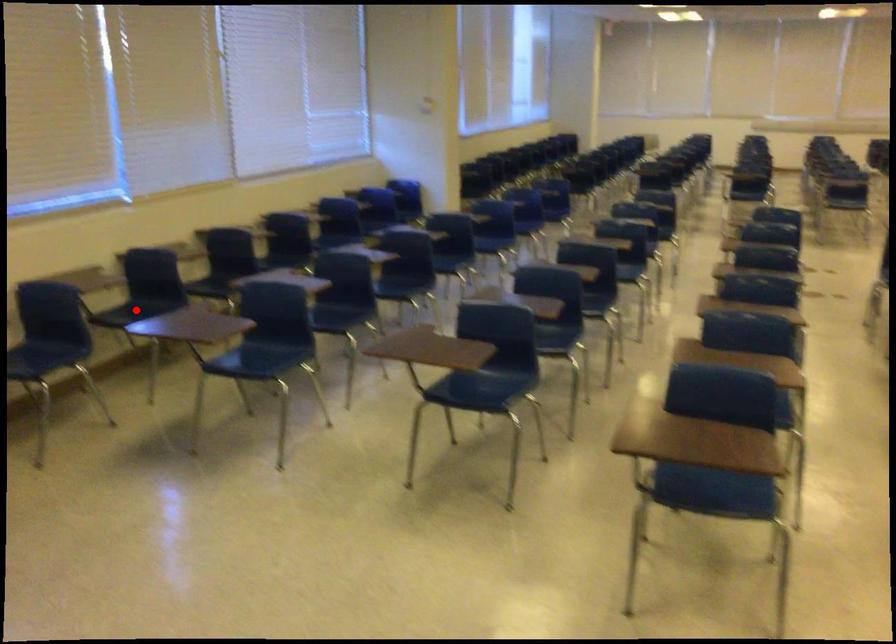
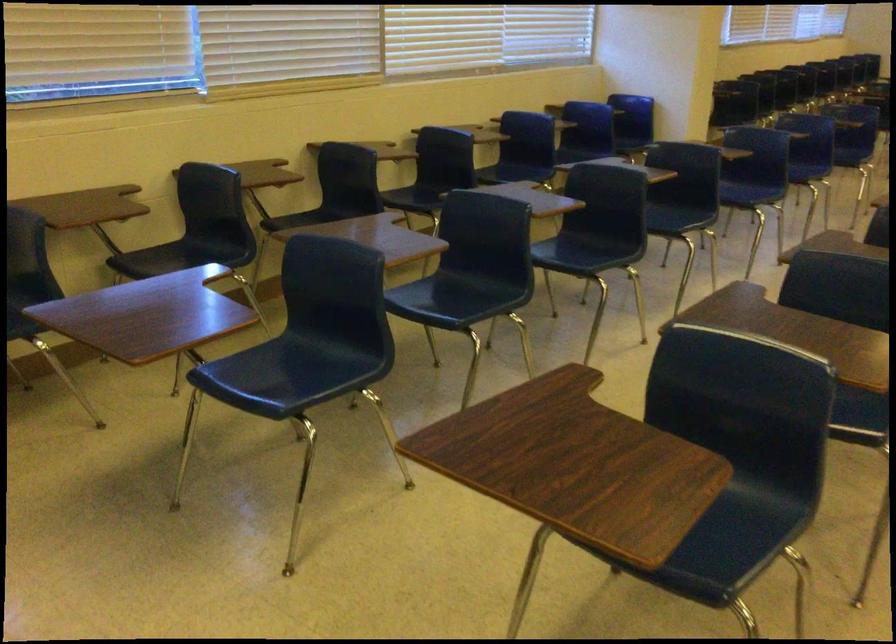
Question: I am providing you with two images of the same scene from different viewpoints. A red point is shown in image1. For the corresponding object point in image2, is it positioned nearer or farther from the camera?

Choices:
 (A) Nearer
 (B) Farther

Answer: (A)